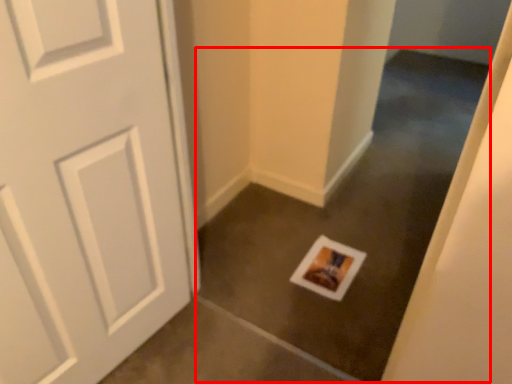
Question: In this image, where is concrete (annotated by the red box) located relative to postcard?

Choices:
 (A) left
 (B) right

Answer: (A)